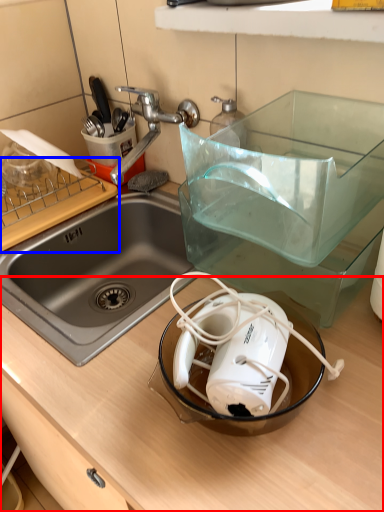
Question: Which point is closer to the camera, counter top (highlighted by a red box) or cutting board (highlighted by a blue box)?

Choices:
 (A) counter top
 (B) cutting board

Answer: (A)